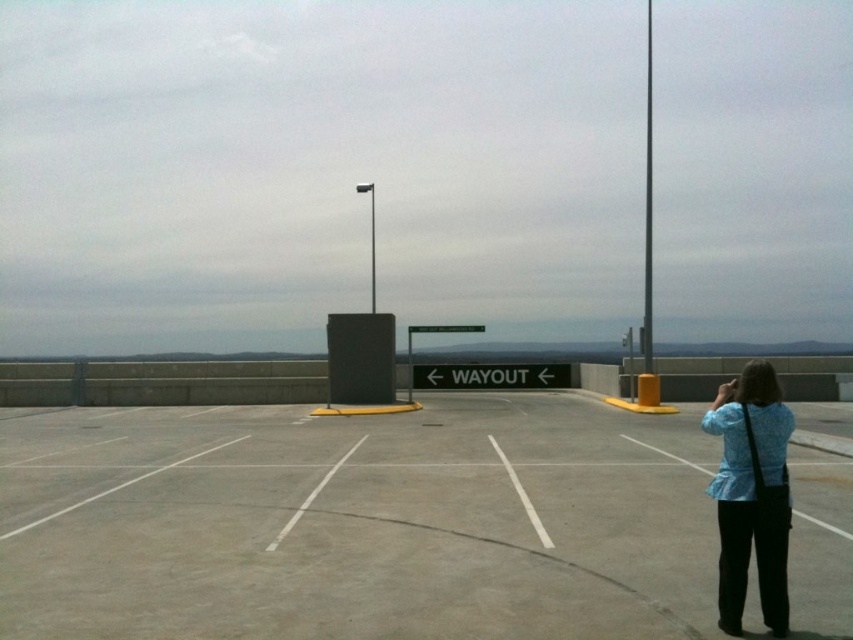
Is gray concrete parking lot at center thinner than blue fabric shirt at right?

No, gray concrete parking lot at center is not thinner than blue fabric shirt at right.

Between gray concrete parking lot at center and blue fabric shirt at right, which one has more height?

With more height is blue fabric shirt at right.

Does point (633, 552) lie in front of point (764, 381)?

No, (633, 552) is further to viewer.

Locate an element on the screen. The width and height of the screenshot is (853, 640). gray concrete parking lot at center is located at coordinates (357, 522).